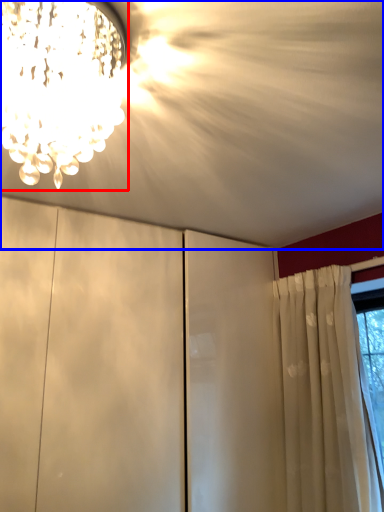
Question: Which object is closer to the camera taking this photo, lamp (highlighted by a red box) or cloud (highlighted by a blue box)?

Choices:
 (A) lamp
 (B) cloud

Answer: (B)